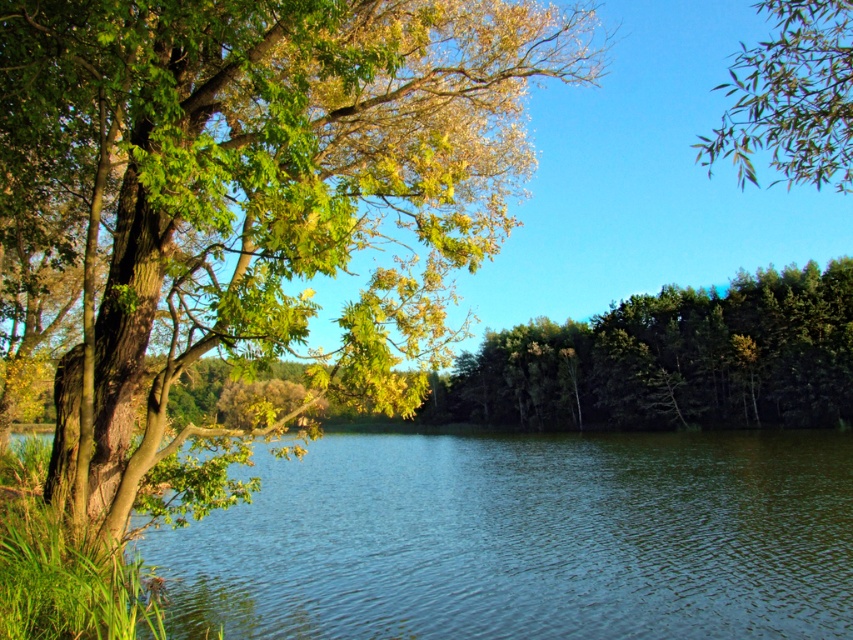
Question: Observing the image, what is the correct spatial positioning of green leafy tree at left in reference to clear blue water at center?

Choices:
 (A) below
 (B) above

Answer: (B)

Question: In this image, where is green leafy tree at left located relative to clear blue water at center?

Choices:
 (A) right
 (B) left

Answer: (B)

Question: Which point is closer to the camera taking this photo?

Choices:
 (A) (517, 538)
 (B) (654, 317)

Answer: (A)

Question: Does clear blue water at center appear over green matte forest at center?

Choices:
 (A) yes
 (B) no

Answer: (B)

Question: Which of the following is the closest to the observer?

Choices:
 (A) (259, 580)
 (B) (192, 269)
 (C) (741, 371)

Answer: (B)

Question: Which point is closer to the camera?

Choices:
 (A) green leafy branch at upper right
 (B) clear blue water at center

Answer: (A)